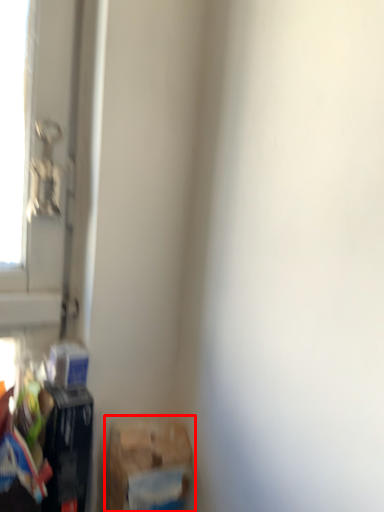
Question: From the image's perspective, what is the correct spatial positioning of waste (annotated by the red box) in reference to waste?

Choices:
 (A) above
 (B) below

Answer: (B)